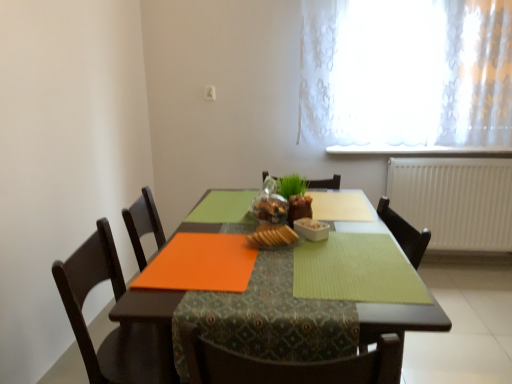
Locate an element on the screen. Image resolution: width=512 pixels, height=384 pixels. vacant space in front of slightly toasted bread at center is located at coordinates (274, 266).